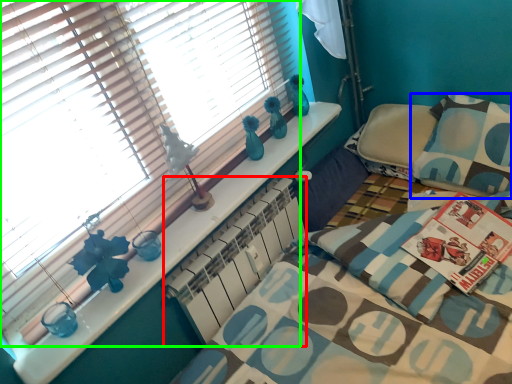
Question: Which object is positioned closest to radiator (highlighted by a red box)? Select from pillow (highlighted by a blue box) and window blind (highlighted by a green box).

Choices:
 (A) pillow
 (B) window blind

Answer: (B)